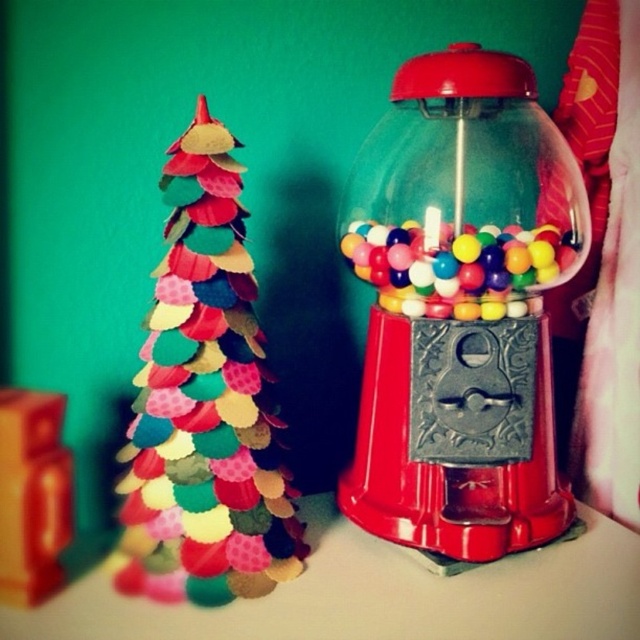
Does shiny plastic gumball machine at right have a greater width compared to multicolored felt christmas tree at left?

Correct, the width of shiny plastic gumball machine at right exceeds that of multicolored felt christmas tree at left.

Between point (492, 172) and point (188, 372), which one is positioned in front?

Point (188, 372)

Find the location of a particular element. The width and height of the screenshot is (640, 640). shiny plastic gumball machine at right is located at coordinates (460, 307).

Looking at this image, who is more distant from viewer, (376,449) or (406,228)?

The point (406,228) is behind.

Does shiny plastic gumball machine at right lie in front of shiny plastic gumballs at center?

Yes, shiny plastic gumball machine at right is in front of shiny plastic gumballs at center.

Find the location of `shiny plastic gumball machine at right`. shiny plastic gumball machine at right is located at coordinates (460, 307).

Where is `shiny plastic gumball machine at right`? The height and width of the screenshot is (640, 640). shiny plastic gumball machine at right is located at coordinates (460, 307).

Which is above, multicolored felt christmas tree at left or matte cardboard box at lower left?

multicolored felt christmas tree at left

Consider the image. Who is shorter, multicolored felt christmas tree at left or matte cardboard box at lower left?

matte cardboard box at lower left

Describe the element at coordinates (204, 403) in the screenshot. I see `multicolored felt christmas tree at left` at that location.

Where is `multicolored felt christmas tree at left`? This screenshot has height=640, width=640. multicolored felt christmas tree at left is located at coordinates (204, 403).